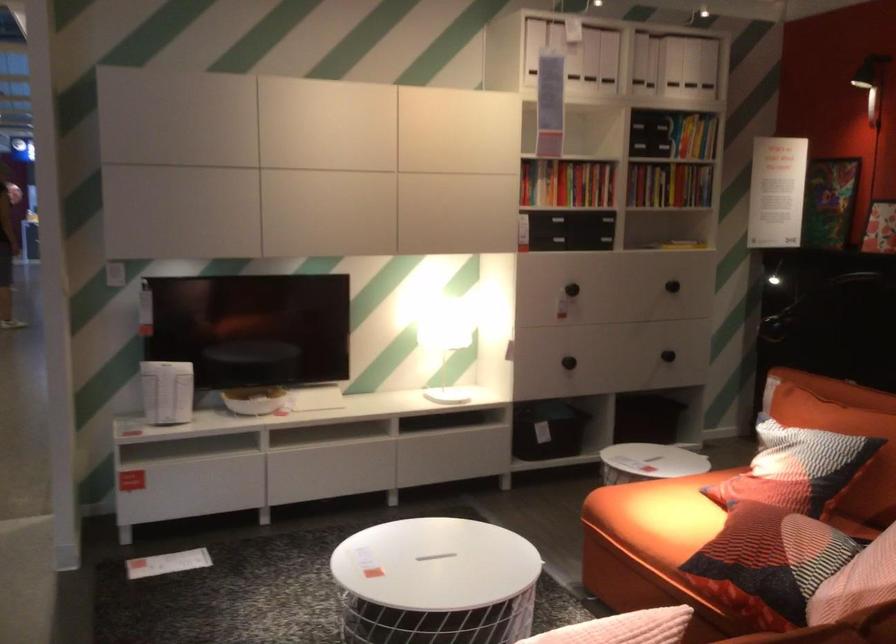
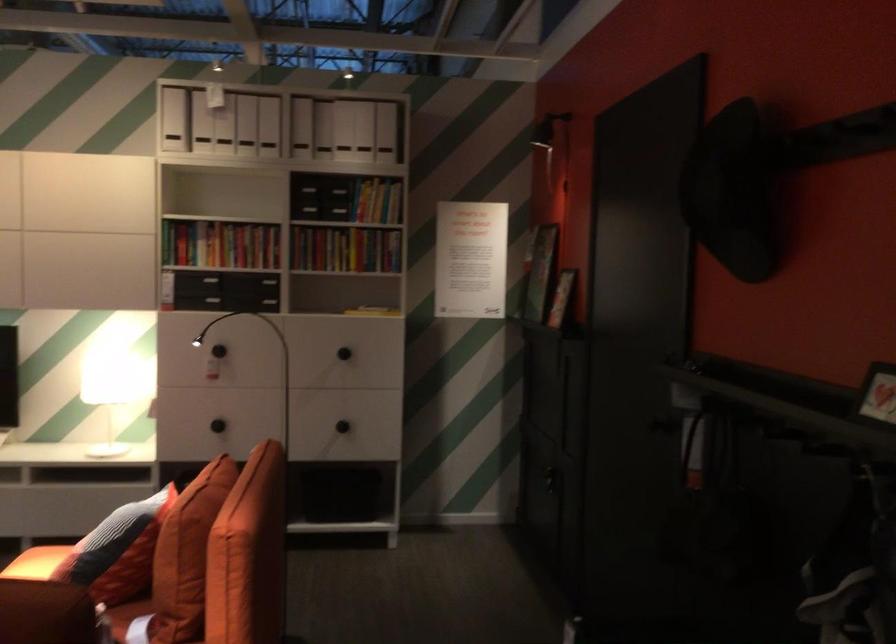
In the second image, find the point that corresponds to point (721, 221) in the first image.

(372, 310)